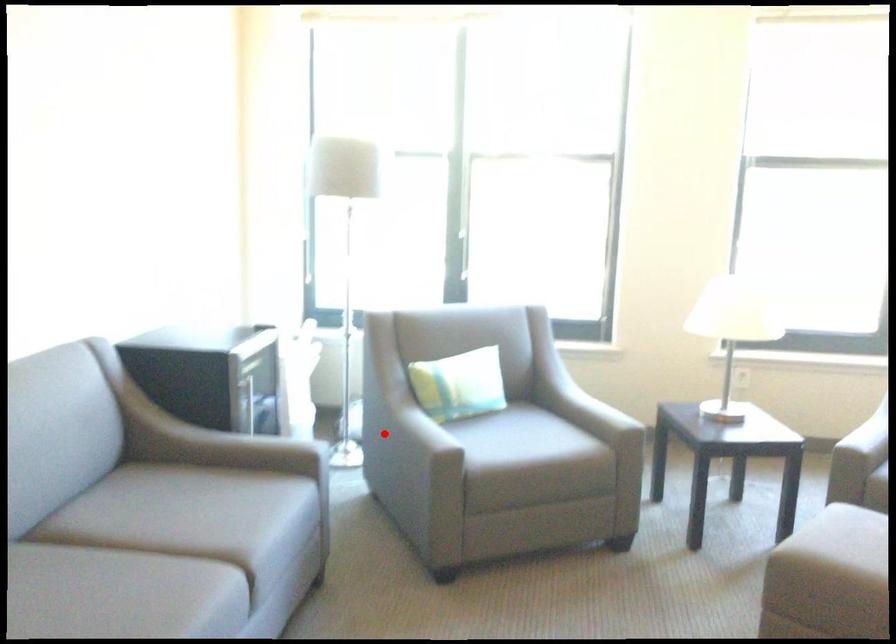
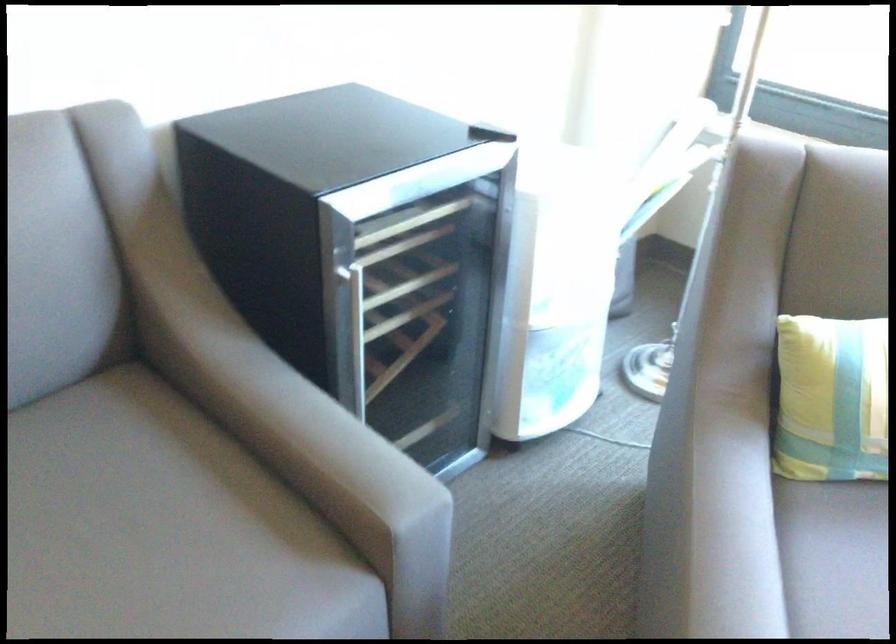
Question: I am providing you with two images of the same scene from different viewpoints. Given a red point in image1, look at the same physical point in image2. Is it:

Choices:
 (A) Closer to the viewpoint
 (B) Farther from the viewpoint

Answer: (A)